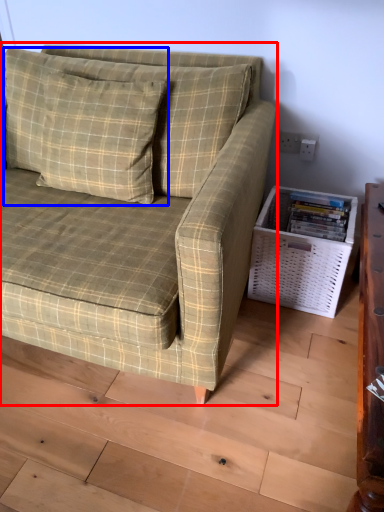
Question: Which point is closer to the camera, studio couch (highlighted by a red box) or pillow (highlighted by a blue box)?

Choices:
 (A) studio couch
 (B) pillow

Answer: (A)